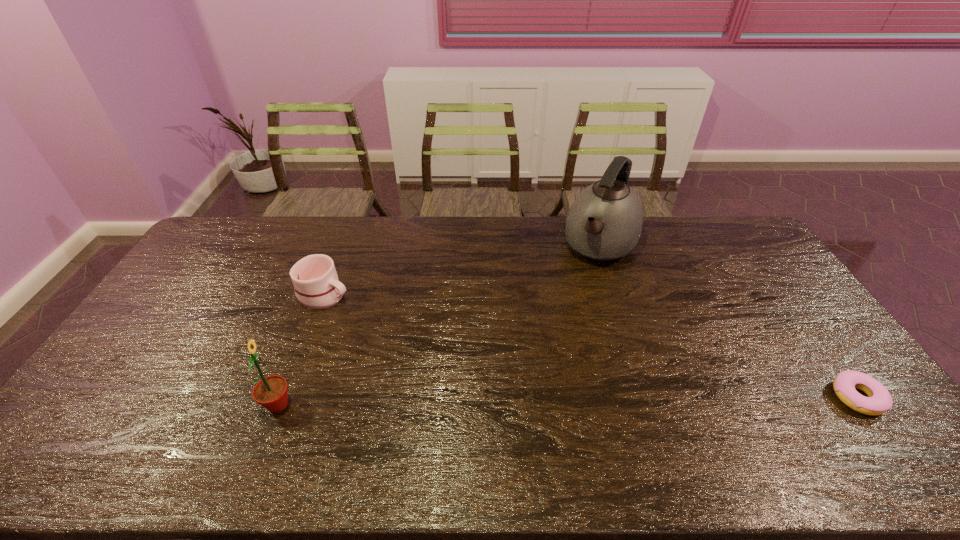
Find the location of a particular element. free spot on the desktop that is between the third shortest object and the doughnut and is positioned on the side with the handle of the mug is located at coordinates (554, 401).

The image size is (960, 540). Identify the location of vacant space on the desktop that is between the sunflower and the rightmost object and is positioned at the spout of the second object from right to left. (508, 402).